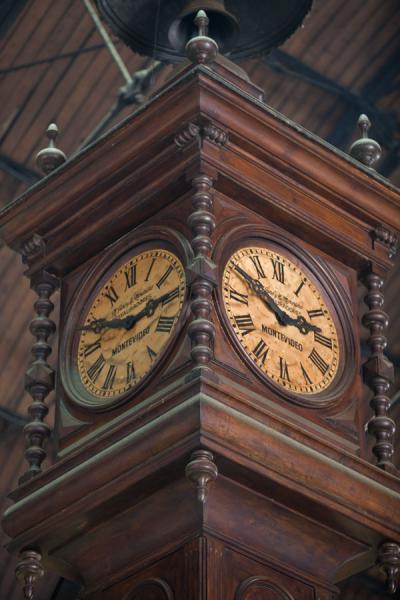
I want to click on ceiling bars, so (x=137, y=84), (x=49, y=61).